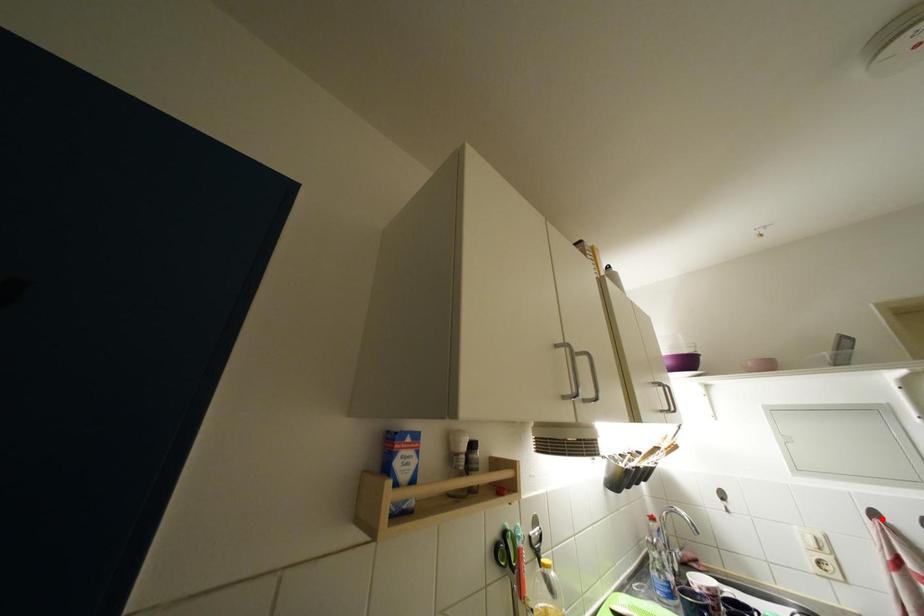
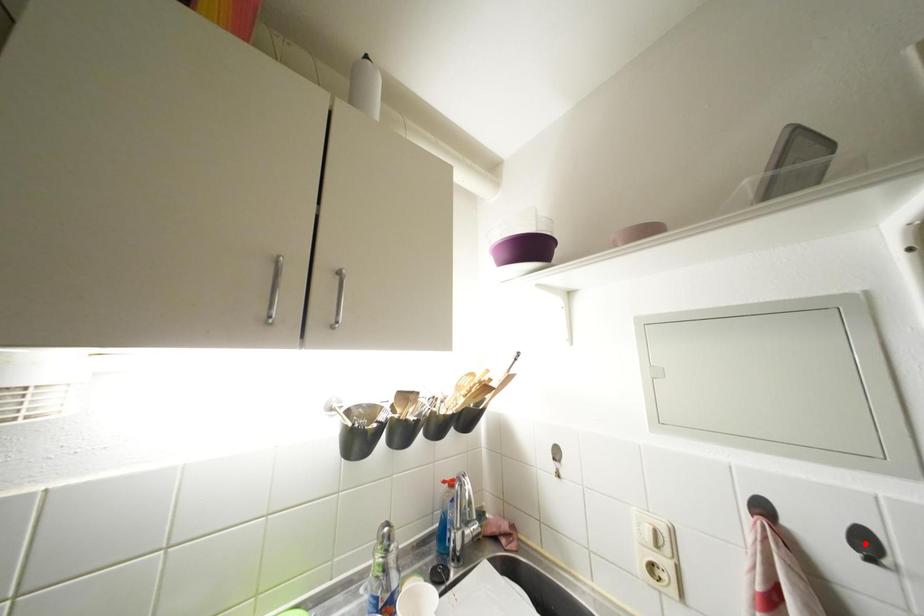
I am providing you with two images of the same scene from different viewpoints. A red point is marked on the first image and another point is marked on the second image. Is the marked point in image1 the same physical position as the marked point in image2?

No